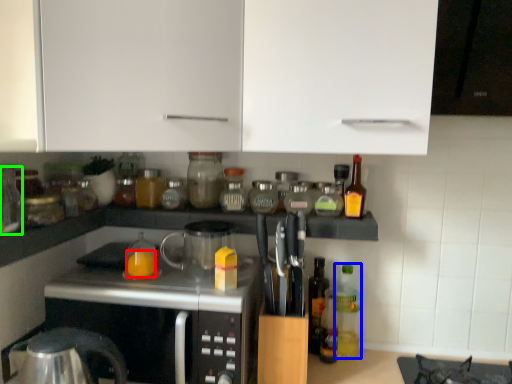
Question: Based on their relative distances, which object is farther from orange juice (highlighted by a red box)? Choose from bottle (highlighted by a blue box) and bottle (highlighted by a green box).

Choices:
 (A) bottle
 (B) bottle

Answer: (A)